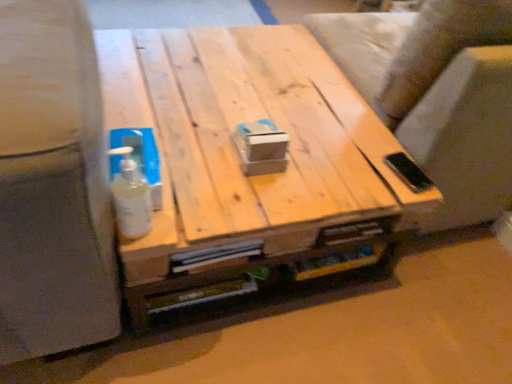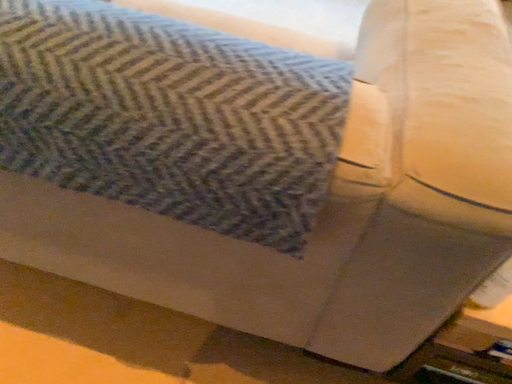
Question: Which way did the camera rotate in the video?

Choices:
 (A) rotated right
 (B) rotated left

Answer: (B)